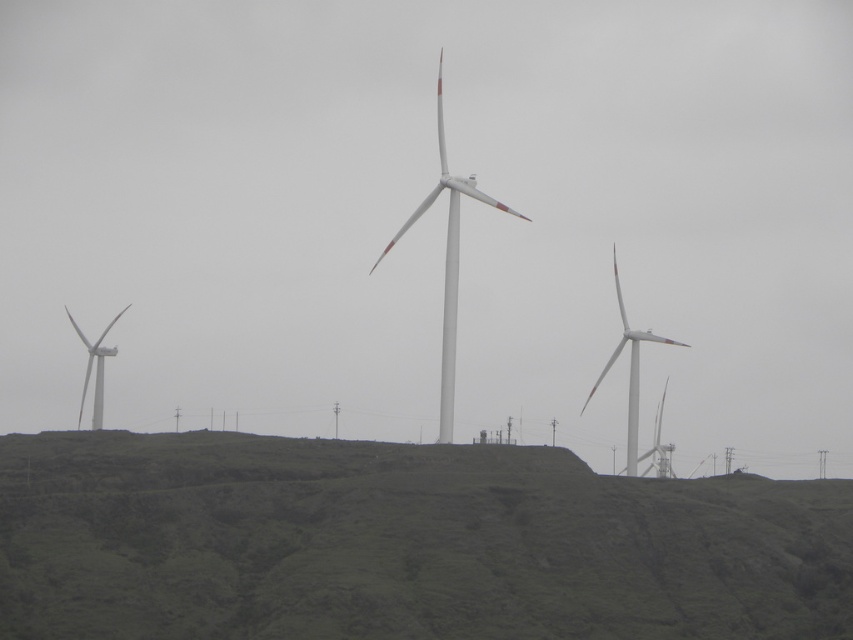
Based on the photo, you are a drone operator trying to navigate a drone between the green grassy hillside at center and the white matte windmill at center. Which object should you fly around to avoid collision?

The green grassy hillside at center is positioned on the left side of the white matte windmill at center. To avoid collision, you should fly around the white matte windmill at center since it is the structure in the way, while the green grassy hillside at center is to its left and might not block the path directly.

You are a bird flying over the green grassy hillside at center and the white matte windmill at center. Which object is taller from your perspective?

The white matte windmill at center is taller than the green grassy hillside at center.

You are a drone operator planning to fly a drone between the white matte windmill at center and the white matte windmill at right. Considering their sizes, which windmill might pose a greater obstruction for the drone due to its size?

The white matte windmill at center is larger than the white matte windmill at right, so it would pose a greater obstruction for the drone due to its size.